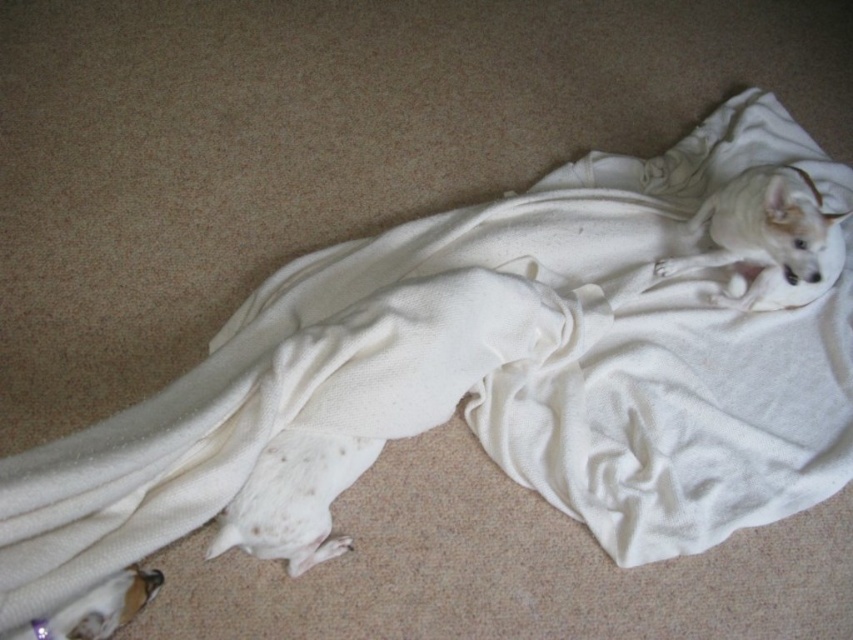
Question: Does white soft dog at lower left have a greater width compared to white soft fur dog at lower left?

Choices:
 (A) no
 (B) yes

Answer: (B)

Question: Is white soft dog at lower left bigger than white soft fur dog at lower left?

Choices:
 (A) yes
 (B) no

Answer: (A)

Question: In this image, where is white soft dog at lower left located relative to white soft fur dog at lower left?

Choices:
 (A) left
 (B) right

Answer: (B)

Question: Which object is positioned farthest from the white soft dog at lower left?

Choices:
 (A) white soft fur dog at lower left
 (B) white soft dog at upper right

Answer: (B)

Question: Which point is closer to the camera taking this photo?

Choices:
 (A) (728, 292)
 (B) (126, 577)

Answer: (B)

Question: Which object is farther from the camera taking this photo?

Choices:
 (A) white soft fur dog at lower left
 (B) white soft dog at upper right
 (C) white soft dog at lower left

Answer: (B)